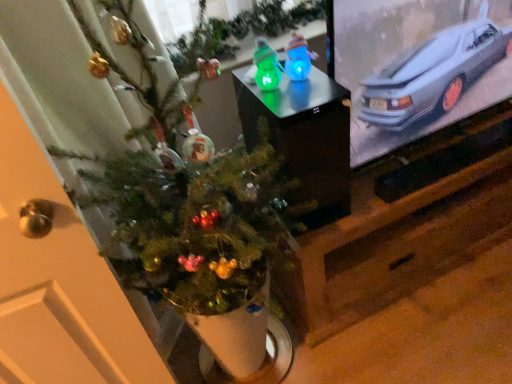
Question: Can you confirm if blue translucent snowman at center, placed as the second toy when sorted from left to right, is thinner than glossy plastic snowmen at center?

Choices:
 (A) yes
 (B) no

Answer: (A)

Question: Is blue translucent snowman at center, placed as the 1th toy when sorted from right to left, to the right of glossy plastic snowmen at center from the viewer's perspective?

Choices:
 (A) yes
 (B) no

Answer: (A)

Question: Is blue translucent snowman at center, placed as the 1th toy when sorted from right to left, smaller than glossy plastic snowmen at center?

Choices:
 (A) yes
 (B) no

Answer: (A)

Question: Is blue translucent snowman at center, placed as the second toy when sorted from left to right, in front of glossy plastic snowmen at center?

Choices:
 (A) yes
 (B) no

Answer: (B)

Question: From a real-world perspective, is blue translucent snowman at center, placed as the second toy when sorted from left to right, over glossy plastic snowmen at center?

Choices:
 (A) no
 (B) yes

Answer: (B)

Question: Is blue translucent snowman at center, placed as the 1th toy when sorted from right to left, bigger or smaller than green matte christmas tree at center?

Choices:
 (A) small
 (B) big

Answer: (A)

Question: Is blue translucent snowman at center, placed as the 1th toy when sorted from right to left, inside or outside of green matte christmas tree at center?

Choices:
 (A) inside
 (B) outside

Answer: (B)

Question: From the image's perspective, is blue translucent snowman at center, placed as the 1th toy when sorted from right to left, positioned above or below green matte christmas tree at center?

Choices:
 (A) below
 (B) above

Answer: (B)

Question: From a real-world perspective, is blue translucent snowman at center, placed as the 1th toy when sorted from right to left, above or below green matte christmas tree at center?

Choices:
 (A) below
 (B) above

Answer: (B)

Question: In terms of height, does glossy plastic snowmen at center look taller or shorter compared to green translucent toy at center, marked as the second toy in a right-to-left arrangement?

Choices:
 (A) tall
 (B) short

Answer: (A)

Question: Based on their sizes in the image, would you say glossy plastic snowmen at center is bigger or smaller than green translucent toy at center, marked as the second toy in a right-to-left arrangement?

Choices:
 (A) small
 (B) big

Answer: (B)

Question: From a real-world perspective, relative to green translucent toy at center, which is the 1th toy in left-to-right order, is glossy plastic snowmen at center vertically above or below?

Choices:
 (A) above
 (B) below

Answer: (B)

Question: Considering their positions, is glossy plastic snowmen at center located in front of or behind green translucent toy at center, which is the 1th toy in left-to-right order?

Choices:
 (A) behind
 (B) front

Answer: (B)

Question: Is green matte christmas tree at center wider or thinner than glossy plastic snowmen at center?

Choices:
 (A) wide
 (B) thin

Answer: (A)

Question: From a real-world perspective, relative to glossy plastic snowmen at center, is green matte christmas tree at center vertically above or below?

Choices:
 (A) below
 (B) above

Answer: (A)